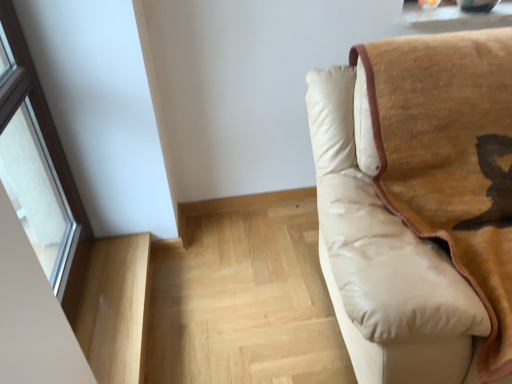
You are a GUI agent. You are given a task and a screenshot of the screen. Output one action in this format:
    pyautogui.click(x=<x>, y=<y>)
    Task: Click on the vacant region to the right of transparent glass window at left
    
    Given the screenshot: What is the action you would take?
    pyautogui.click(x=121, y=295)